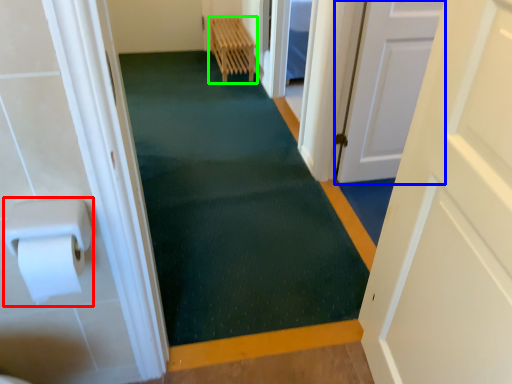
Question: Which object is the farthest from paper towel (highlighted by a red box)? Choose among these: door (highlighted by a blue box) or furniture (highlighted by a green box).

Choices:
 (A) door
 (B) furniture

Answer: (B)